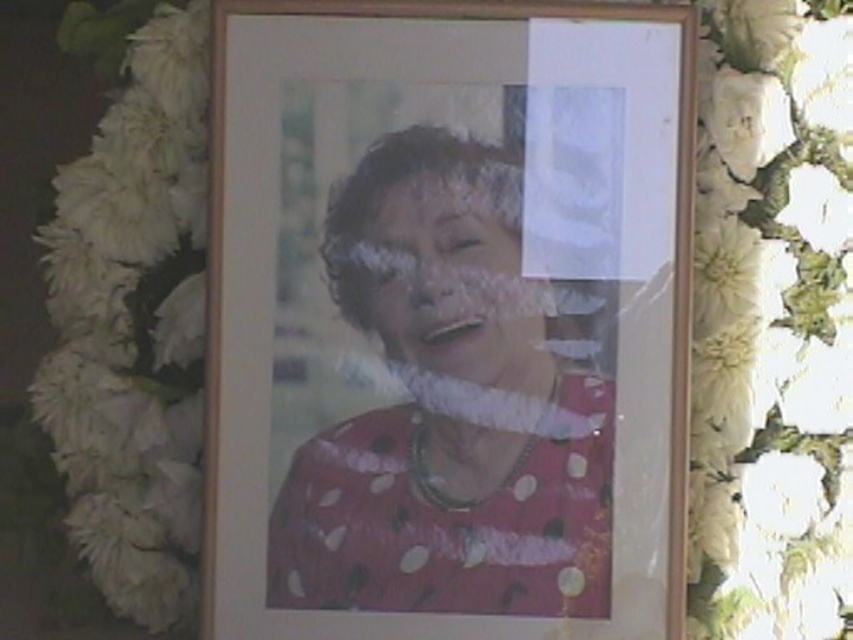
Question: Is wooden picture frame at center behind white fluffy petals at left?

Choices:
 (A) no
 (B) yes

Answer: (A)

Question: Which object is positioned farthest from the white fluffy petals at left?

Choices:
 (A) matte pink polka dot dress at center
 (B) white fluffy petals at right

Answer: (B)

Question: Does wooden picture frame at center lie in front of white fluffy petals at left?

Choices:
 (A) yes
 (B) no

Answer: (A)

Question: Which of the following is the closest to the observer?

Choices:
 (A) wooden picture frame at center
 (B) matte pink lips at center

Answer: (A)

Question: Does wooden picture frame at center lie behind white fluffy petals at left?

Choices:
 (A) no
 (B) yes

Answer: (A)

Question: Which of the following is the farthest from the observer?

Choices:
 (A) (521, 362)
 (B) (189, 224)
 (C) (473, 332)
 (D) (630, 589)

Answer: (B)